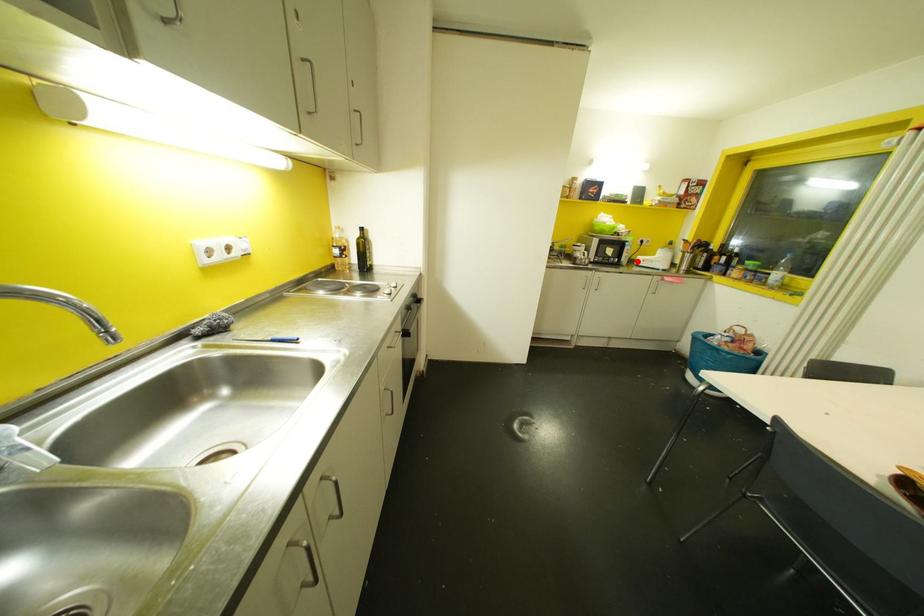
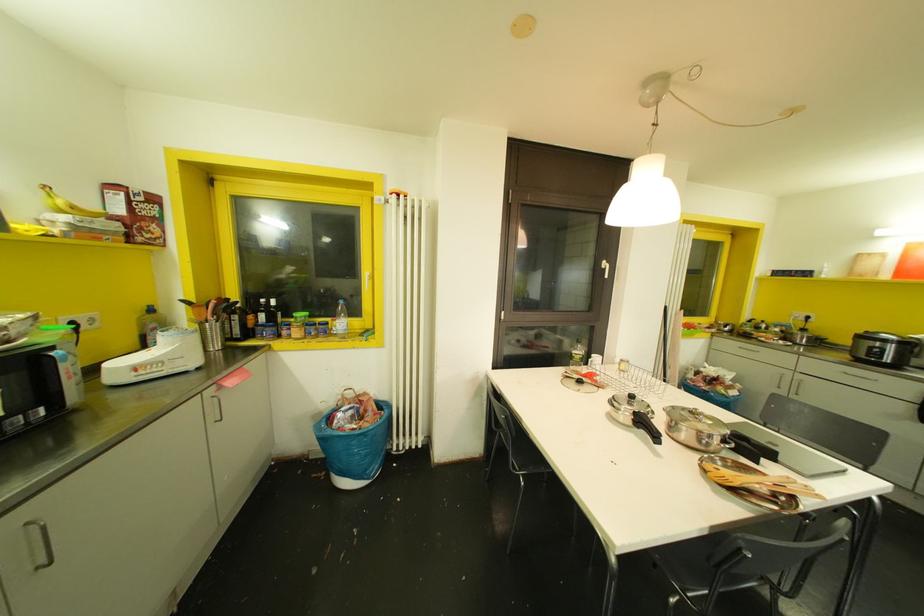
Question: I am providing you with two images of the same scene from different viewpoints. A red point is shown in image1. For the corresponding object point in image2, is it positioned nearer or farther from the camera?

Choices:
 (A) Nearer
 (B) Farther

Answer: (B)